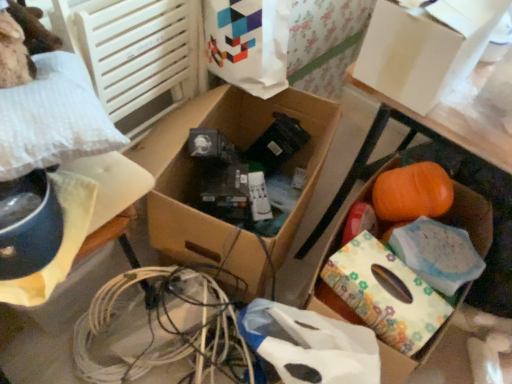
Where is `floral-patterned paper at lower right`? This screenshot has width=512, height=384. floral-patterned paper at lower right is located at coordinates (385, 294).

The height and width of the screenshot is (384, 512). Describe the element at coordinates (335, 251) in the screenshot. I see `orange matte pumpkin at center, the fourth storage box positioned from the left` at that location.

Where is `orange matte pumpkin at center, the fourth storage box positioned from the left`? orange matte pumpkin at center, the fourth storage box positioned from the left is located at coordinates (335, 251).

Measure the distance between point (18, 308) and camera.

The distance of point (18, 308) from camera is 3.76 feet.

You are a GUI agent. You are given a task and a screenshot of the screen. Output one action in this format:
    pyautogui.click(x=<x>, y=<y>)
    Task: Click on the floral-patterned paper at lower right
    
    Given the screenshot: What is the action you would take?
    pyautogui.click(x=385, y=294)

Considering the positions of objects white plastic bag at left, the fourth storage box viewed from the right, and white paper bag at upper center in the image provided, who is in front, white plastic bag at left, the fourth storage box viewed from the right, or white paper bag at upper center?

white plastic bag at left, the fourth storage box viewed from the right, is in front.

Does white plastic bag at left, the fourth storage box viewed from the right, have a lesser width compared to white paper bag at upper center?

In fact, white plastic bag at left, the fourth storage box viewed from the right, might be wider than white paper bag at upper center.

From a real-world perspective, is white plastic bag at left, the first storage box when ordered from left to right, positioned under white paper bag at upper center based on gravity?

Indeed, from a real-world perspective, white plastic bag at left, the first storage box when ordered from left to right, is positioned beneath white paper bag at upper center.

Does white plastic bag at left, the first storage box when ordered from left to right, have a larger size compared to white paper bag at upper center?

No.

From the image's perspective, is white paper bag at upper center on cardboard box at center, positioned as the 3th storage box in right-to-left order?

Yes, from the image's perspective, white paper bag at upper center is over cardboard box at center, positioned as the 3th storage box in right-to-left order.

Considering the positions of points (267, 56) and (243, 259), is point (267, 56) farther from camera compared to point (243, 259)?

Yes, point (267, 56) is behind point (243, 259).

From a real-world perspective, between white paper bag at upper center and cardboard box at center, positioned as the 3th storage box in right-to-left order, who is vertically lower?

cardboard box at center, positioned as the 3th storage box in right-to-left order, from a real-world perspective.

Is white paper bag at upper center further to camera compared to cardboard box at center, positioned as the 3th storage box in right-to-left order?

Yes, white paper bag at upper center is behind cardboard box at center, positioned as the 3th storage box in right-to-left order.

Which is in front, point (400, 35) or point (423, 338)?

The point (400, 35) is closer.

Is white cardboard box at upper right, the 2th storage box viewed from the right, positioned behind floral-patterned paper at lower right?

No.

Which of these two, white cardboard box at upper right, the 2th storage box viewed from the right, or floral-patterned paper at lower right, is thinner?

Thinner between the two is floral-patterned paper at lower right.

From the picture: Considering the sizes of objects white matte wrapping paper at lower center and cardboard box at center, arranged as the 2th storage box when viewed from the left, in the image provided, who is smaller, white matte wrapping paper at lower center or cardboard box at center, arranged as the 2th storage box when viewed from the left,?

Smaller between the two is white matte wrapping paper at lower center.

This screenshot has width=512, height=384. Identify the location of wrapping paper on the right of cardboard box at center, arranged as the 2th storage box when viewed from the left. (310, 345).

From the image's perspective, which object appears higher, white matte wrapping paper at lower center or cardboard box at center, arranged as the 2th storage box when viewed from the left?

cardboard box at center, arranged as the 2th storage box when viewed from the left, from the image's perspective.

In terms of height, does white matte wrapping paper at lower center look taller or shorter compared to cardboard box at center, positioned as the 3th storage box in right-to-left order?

Clearly, white matte wrapping paper at lower center is shorter compared to cardboard box at center, positioned as the 3th storage box in right-to-left order.

Which point is more distant from viewer, (x=398, y=329) or (x=373, y=341)?

Point (x=373, y=341)

Are floral-patterned paper at lower right and white matte wrapping paper at lower center far apart?

floral-patterned paper at lower right is near white matte wrapping paper at lower center, not far away.

Is floral-patterned paper at lower right facing away from white matte wrapping paper at lower center?

No, floral-patterned paper at lower right's orientation is not away from white matte wrapping paper at lower center.

Is white matte wrapping paper at lower center at the left side of white plastic bag at left, the fourth storage box viewed from the right?

No.

Between white matte wrapping paper at lower center and white plastic bag at left, the first storage box when ordered from left to right, which one is positioned in front?

white plastic bag at left, the first storage box when ordered from left to right, is closer to the camera.

Is white plastic bag at left, the first storage box when ordered from left to right, surrounded by white matte wrapping paper at lower center?

No.

Looking at this image, from a real-world perspective, relative to white plastic bag at left, the first storage box when ordered from left to right, is white matte wrapping paper at lower center vertically above or below?

Clearly, from a real-world perspective, white matte wrapping paper at lower center is below white plastic bag at left, the first storage box when ordered from left to right.

Is orange matte pumpkin at center, the fourth storage box positioned from the left, bigger than white plastic bag at left, the first storage box when ordered from left to right?

Yes.

Can you confirm if orange matte pumpkin at center, which is counted as the 1th storage box, starting from the right, is positioned to the left of white plastic bag at left, the fourth storage box viewed from the right?

No, orange matte pumpkin at center, which is counted as the 1th storage box, starting from the right, is not to the left of white plastic bag at left, the fourth storage box viewed from the right.

From the image's perspective, which one is positioned higher, orange matte pumpkin at center, which is counted as the 1th storage box, starting from the right, or white plastic bag at left, the fourth storage box viewed from the right?

white plastic bag at left, the fourth storage box viewed from the right, is shown above in the image.

Considering the sizes of objects orange matte pumpkin at center, the fourth storage box positioned from the left, and white plastic bag at left, the fourth storage box viewed from the right, in the image provided, who is shorter, orange matte pumpkin at center, the fourth storage box positioned from the left, or white plastic bag at left, the fourth storage box viewed from the right,?

white plastic bag at left, the fourth storage box viewed from the right, is shorter.

I want to click on shopping bag on the right of white plastic bag at left, the fourth storage box viewed from the right, so click(248, 43).

From a real-world perspective, count 2nd storage boxs downward from the white paper bag at upper center and point to it. Please provide its 2D coordinates.

[(198, 179)]

Consider the image. Estimate the real-world distances between objects in this image. Which object is further from orange matte pumpkin at center, the fourth storage box positioned from the left, white plastic bag at left, the fourth storage box viewed from the right, or white cardboard box at upper right, which appears as the 3th storage box when viewed from the left?

white plastic bag at left, the fourth storage box viewed from the right, lies further to orange matte pumpkin at center, the fourth storage box positioned from the left, than the other object.

Which object lies further to the anchor point white cardboard box at upper right, the 2th storage box viewed from the right, cardboard box at center, arranged as the 2th storage box when viewed from the left, or floral-patterned paper at lower right?

Among the two, cardboard box at center, arranged as the 2th storage box when viewed from the left, is located further to white cardboard box at upper right, the 2th storage box viewed from the right.

Based on the photo, when comparing their distances from orange matte pumpkin at center, which is counted as the 1th storage box, starting from the right, does white matte wrapping paper at lower center or white plastic bag at left, the fourth storage box viewed from the right, seem closer?

white matte wrapping paper at lower center is positioned closer to the anchor orange matte pumpkin at center, which is counted as the 1th storage box, starting from the right.

Estimate the real-world distances between objects in this image. Which object is closer to white paper bag at upper center, white cardboard box at upper right, the 2th storage box viewed from the right, or cardboard box at center, arranged as the 2th storage box when viewed from the left?

Among the two, cardboard box at center, arranged as the 2th storage box when viewed from the left, is located nearer to white paper bag at upper center.

Which object lies further to the anchor point white plastic bag at left, the fourth storage box viewed from the right, white paper bag at upper center or white matte wrapping paper at lower center?

Among the two, white paper bag at upper center is located further to white plastic bag at left, the fourth storage box viewed from the right.

From the image, which object appears to be farther from white paper bag at upper center, white plastic bag at left, the fourth storage box viewed from the right, or orange matte pumpkin at center, the fourth storage box positioned from the left?

The object further to white paper bag at upper center is orange matte pumpkin at center, the fourth storage box positioned from the left.

Estimate the real-world distances between objects in this image. Which object is further from white plastic bag at left, the first storage box when ordered from left to right, cardboard box at center, arranged as the 2th storage box when viewed from the left, or white paper bag at upper center?

white paper bag at upper center is further to white plastic bag at left, the first storage box when ordered from left to right.

Estimate the real-world distances between objects in this image. Which object is closer to floral-patterned paper at lower right, orange matte pumpkin at center, which is counted as the 1th storage box, starting from the right, or white matte wrapping paper at lower center?

Among the two, orange matte pumpkin at center, which is counted as the 1th storage box, starting from the right, is located nearer to floral-patterned paper at lower right.

The width and height of the screenshot is (512, 384). Identify the location of storage box between white plastic bag at left, the fourth storage box viewed from the right, and white cardboard box at upper right, the 2th storage box viewed from the right, from left to right. (198, 179).

I want to click on storage box between white plastic bag at left, the first storage box when ordered from left to right, and floral-patterned paper at lower right, so click(x=198, y=179).

This screenshot has width=512, height=384. What are the coordinates of `wrapping paper between white plastic bag at left, the first storage box when ordered from left to right, and white cardboard box at upper right, which appears as the 3th storage box when viewed from the left` in the screenshot? It's located at (310, 345).

This screenshot has height=384, width=512. In order to click on cardboard box between cardboard box at center, arranged as the 2th storage box when viewed from the left, and white matte wrapping paper at lower center, in the vertical direction in this screenshot , I will do `click(385, 294)`.